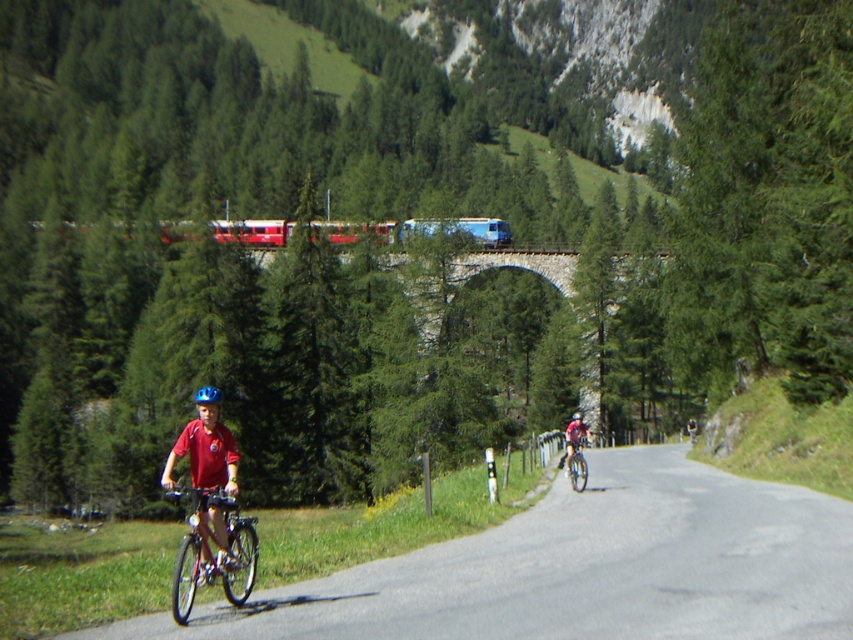
You are a delivery driver planning to drive a truck that is 12 meters long through the area shown. Based on the image, will the truck fit on the smooth asphalt road at center without overlapping the red matte train at center?

The smooth asphalt road at center occupies less space than the red matte train at center. Since the truck is 12 meters long, it may not fit entirely on the road as the road is narrower than the train, which might block the path. However, the description does not specify the exact dimensions of the road or the train, so it is unclear if the truck can fit without overlapping.

You are a delivery drone operator. Your drone has a maximum payload capacity of 5 kilograms. You need to deliver either the red matte train at center or the blue matte helmet at center. According to the scene description, which item can your drone safely carry?

The red matte train at center has a larger size compared to blue matte helmet at center. Since the blue matte helmet at center is smaller, it is likely lighter and within the 5 kg payload limit, making it safe for the drone to carry.

You are a cyclist approaching the road with two shiny metallic bicycles in sight. You want to know the distance between the shiny metallic bicycle at left and the shiny metallic bicycle at center to plan your route. Can you tell me what the distance is?

The shiny metallic bicycle at left is 13.39 meters away from the shiny metallic bicycle at center.